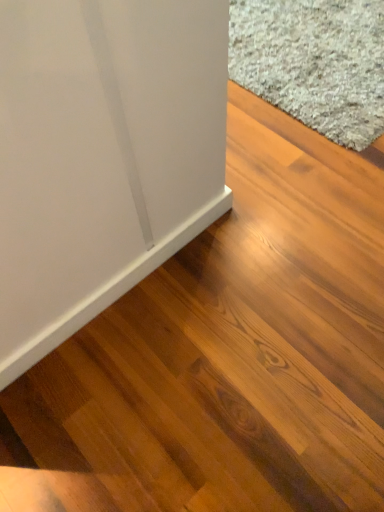
Image resolution: width=384 pixels, height=512 pixels. I want to click on vacant area that lies in front of white matte baseboard at lower left, so click(143, 394).